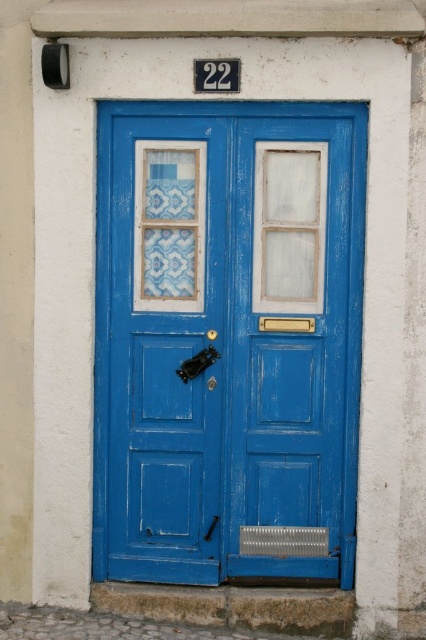
You are a delivery person trying to deliver a package to house number 22. You see the blue painted wood door at center and the white frosted glass at center. Which object should you approach first to deliver the package?

The blue painted wood door at center is in front of the white frosted glass at center, so you should approach the blue painted wood door at center first to deliver the package.

You are standing in front of the double doors and want to touch both points marked on the wall. Which point should you reach for first, the point at coordinate (276, 500) or the point at (302, 260)?

You should reach for point (276, 500) first because it is closer to you than point (302, 260), which is further away.

You are a delivery person trying to deliver a package to house number 22. You see the blue painted wood door at center and the white frosted glass at center. Which object should you look for to place the package near the entrance?

You should place the package near the blue painted wood door at center since it is larger in size than the white frosted glass at center and is the main entrance.